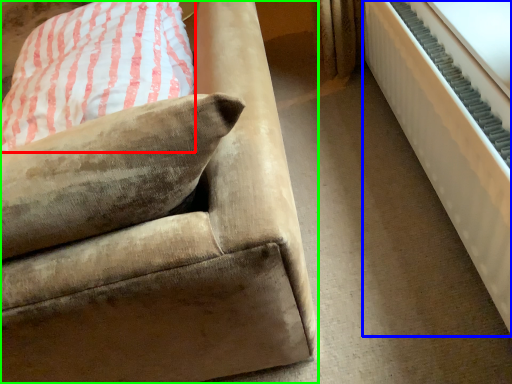
Question: Based on their relative distances, which object is nearer to pillow (highlighted by a red box)? Choose from radiator (highlighted by a blue box) and studio couch (highlighted by a green box).

Choices:
 (A) radiator
 (B) studio couch

Answer: (B)